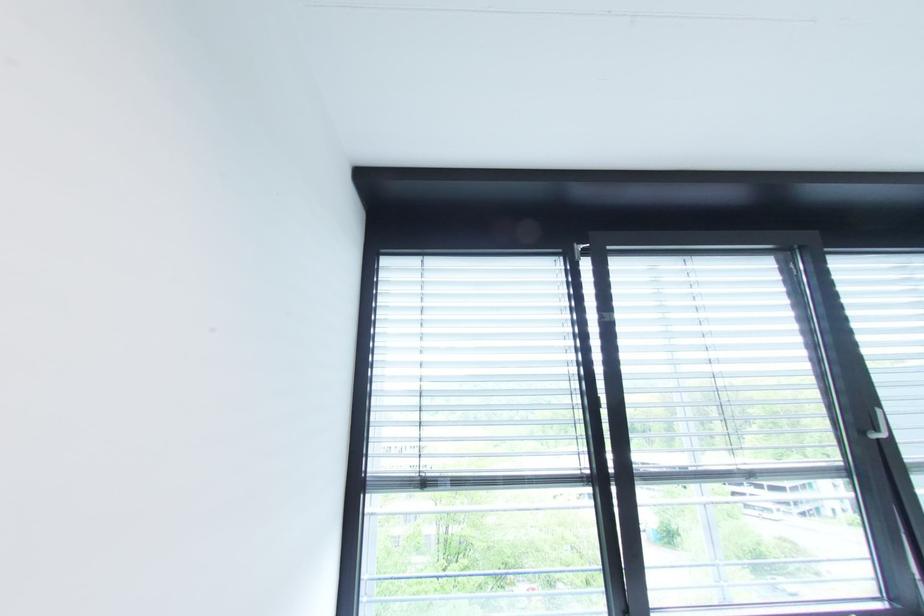
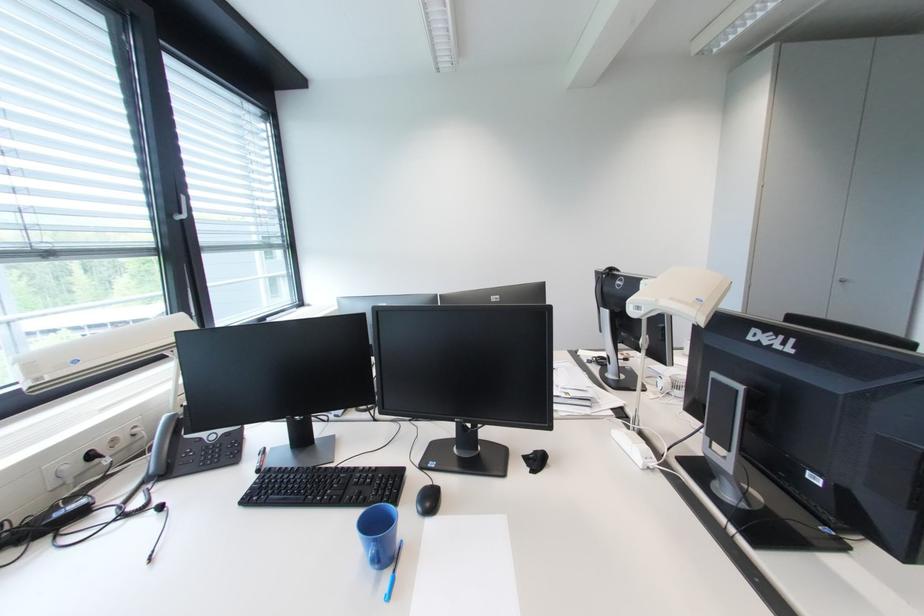
The point at [883,432] is marked in the first image. Where is the corresponding point in the second image?

(188, 215)